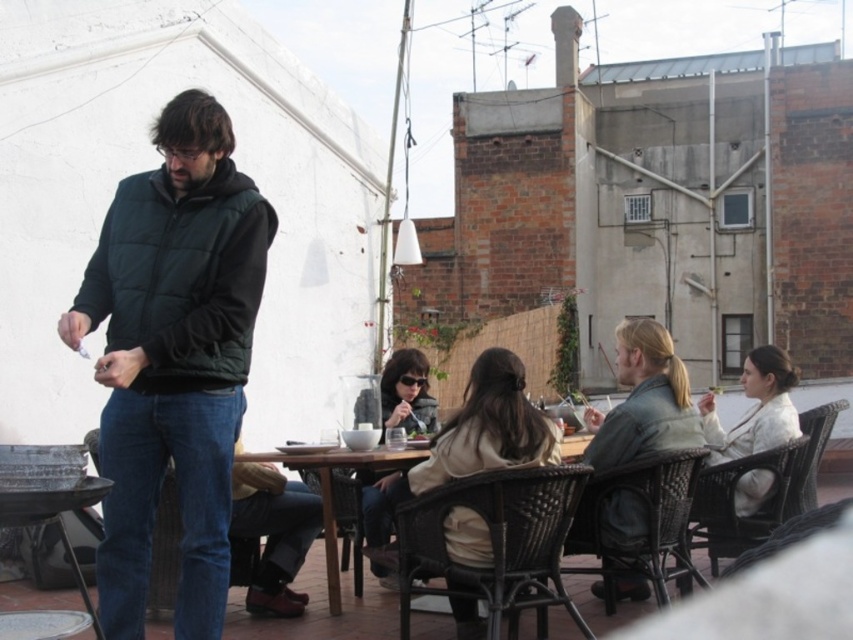
Can you confirm if leather jacket at right is wider than rattan chair at right?

Incorrect, leather jacket at right's width does not surpass rattan chair at right's.

Who is shorter, leather jacket at right or rattan chair at right?

rattan chair at right

The width and height of the screenshot is (853, 640). What are the coordinates of `leather jacket at right` in the screenshot? It's located at (643, 401).

The width and height of the screenshot is (853, 640). I want to click on leather jacket at right, so click(643, 401).

Is point (392, 476) closer to viewer compared to point (364, 458)?

No, it is behind (364, 458).

Is point (392, 504) more distant than point (318, 460)?

Yes.

Is point (381, 384) positioned behind point (338, 452)?

Yes, point (381, 384) is farther from viewer.

The image size is (853, 640). Identify the location of matte black jacket at center. (407, 394).

Between rattan chair at right and metallic silver grill at lower left, which one is positioned higher?

rattan chair at right is higher up.

Is rattan chair at right smaller than metallic silver grill at lower left?

No.

Is point (703, 477) positioned after point (96, 618)?

Yes, it is behind point (96, 618).

I want to click on rattan chair at right, so click(767, 497).